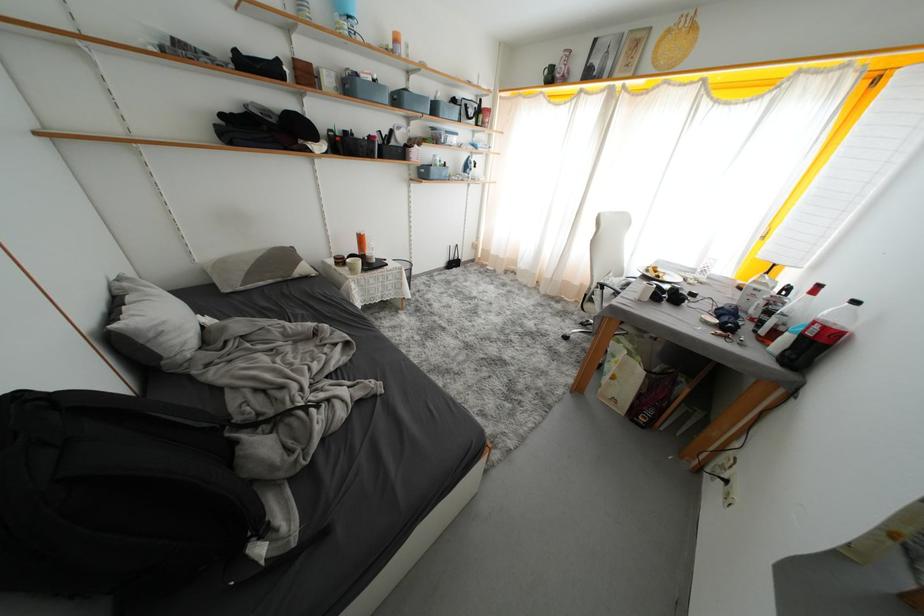
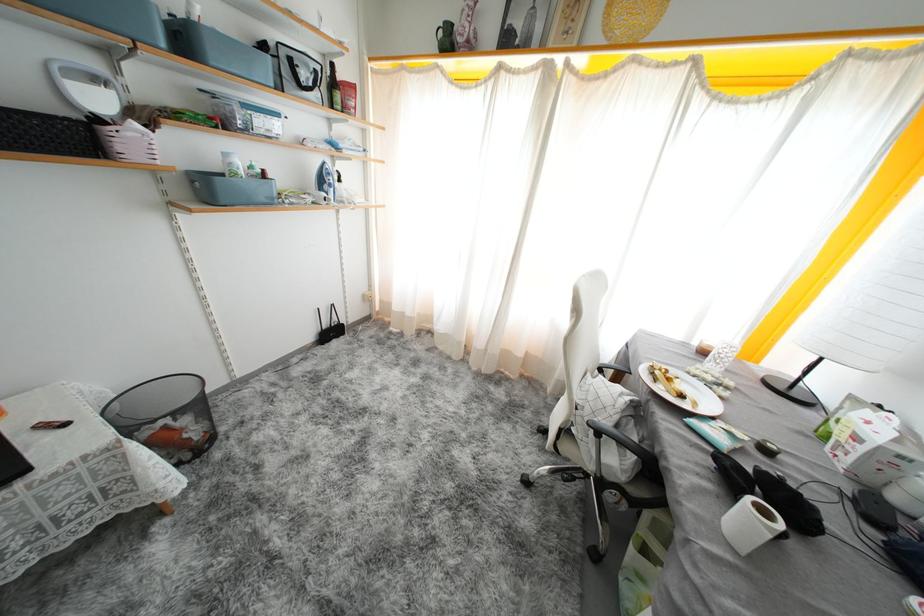
The point at (664,281) is marked in the first image. Where is the corresponding point in the second image?

(687, 400)